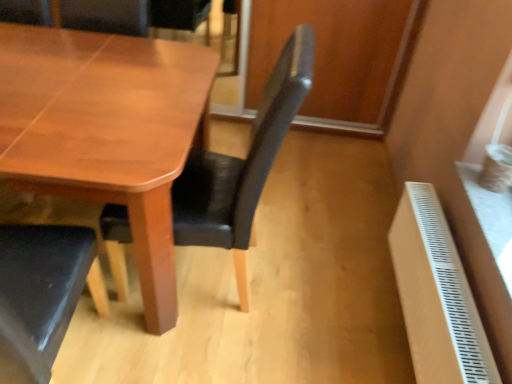
Question: From the image's perspective, is satin black chair at center positioned above or below wooden table at center?

Choices:
 (A) below
 (B) above

Answer: (A)

Question: Is satin black chair at center inside the boundaries of wooden table at center, or outside?

Choices:
 (A) outside
 (B) inside

Answer: (B)

Question: Which of these objects is positioned farthest from the white plastic radiator at lower right?

Choices:
 (A) wooden table at center
 (B) satin black chair at center

Answer: (A)

Question: Based on their relative distances, which object is farther from the white plastic radiator at lower right?

Choices:
 (A) satin black chair at center
 (B) wooden table at center

Answer: (B)